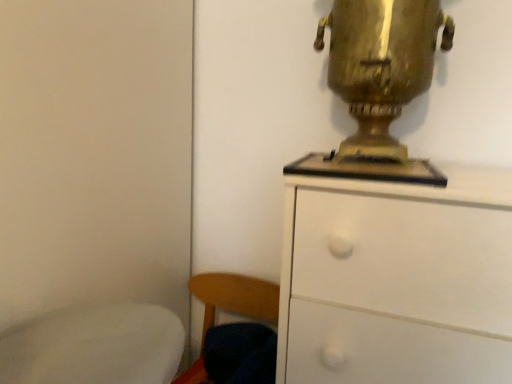
What do you see at coordinates (395, 276) in the screenshot? I see `white matte chest of drawers at upper right` at bounding box center [395, 276].

Identify the location of wooden chair at lower left. The image size is (512, 384). (234, 296).

Between wooden chair at lower left and white matte chest of drawers at upper right, which one has more height?

white matte chest of drawers at upper right.

Consider the image. From the image's perspective, is wooden chair at lower left under white matte chest of drawers at upper right?

Yes, from the image's perspective, wooden chair at lower left is beneath white matte chest of drawers at upper right.

Is wooden chair at lower left directly adjacent to white matte chest of drawers at upper right?

wooden chair at lower left and white matte chest of drawers at upper right are clearly separated.

Is wooden chair at lower left facing towards white matte chest of drawers at upper right?

No, wooden chair at lower left is not turned towards white matte chest of drawers at upper right.

Which object is positioned more to the left, gold metallic samovar at upper right or white matte chest of drawers at upper right?

From the viewer's perspective, gold metallic samovar at upper right appears more on the left side.

Find the location of a particular element. The height and width of the screenshot is (384, 512). table lamp above the white matte chest of drawers at upper right (from a real-world perspective) is located at coordinates (381, 64).

Does point (350, 85) come in front of point (416, 345)?

That is False.

Considering the positions of objects white matte chest of drawers at upper right and wooden chair at lower left in the image provided, who is in front, white matte chest of drawers at upper right or wooden chair at lower left?

white matte chest of drawers at upper right is in front.

Is white matte chest of drawers at upper right far from wooden chair at lower left?

No.

From the picture: Does white matte chest of drawers at upper right have a smaller size compared to wooden chair at lower left?

No, white matte chest of drawers at upper right is not smaller than wooden chair at lower left.

Does white matte chest of drawers at upper right touch gold metallic samovar at upper right?

white matte chest of drawers at upper right and gold metallic samovar at upper right are clearly separated.

From a real-world perspective, between white matte chest of drawers at upper right and gold metallic samovar at upper right, who is vertically higher?

gold metallic samovar at upper right.

Can you tell me how much white matte chest of drawers at upper right and gold metallic samovar at upper right differ in facing direction?

They differ by 6.92 degrees in their facing directions.

From the image's perspective, which object appears higher, white matte chest of drawers at upper right or gold metallic samovar at upper right?

gold metallic samovar at upper right, from the image's perspective.

Is gold metallic samovar at upper right touching wooden chair at lower left?

gold metallic samovar at upper right and wooden chair at lower left are not in contact.

Locate an element on the screen. table lamp in front of the wooden chair at lower left is located at coordinates (381, 64).

How many degrees apart are the facing directions of gold metallic samovar at upper right and wooden chair at lower left?

There is a 6.39-degree angle between the facing directions of gold metallic samovar at upper right and wooden chair at lower left.

Is gold metallic samovar at upper right completely or partially outside of wooden chair at lower left?

Absolutely, gold metallic samovar at upper right is external to wooden chair at lower left.

Which object is positioned more to the left, wooden chair at lower left or gold metallic samovar at upper right?

wooden chair at lower left is more to the left.

Which object is wider, wooden chair at lower left or gold metallic samovar at upper right?

Wider between the two is wooden chair at lower left.

From a real-world perspective, is wooden chair at lower left positioned above or below gold metallic samovar at upper right?

From a real-world perspective, wooden chair at lower left is physically below gold metallic samovar at upper right.

The width and height of the screenshot is (512, 384). Identify the location of chair beneath the white matte chest of drawers at upper right (from a real-world perspective). (234, 296).

At what (x,y) coordinates should I click in order to perform the action: click on table lamp that is above the white matte chest of drawers at upper right (from a real-world perspective). Please return your answer as a coordinate pair (x, y). Looking at the image, I should click on coord(381,64).

Based on their spatial positions, is white matte chest of drawers at upper right or wooden chair at lower left further from gold metallic samovar at upper right?

Based on the image, wooden chair at lower left appears to be further to gold metallic samovar at upper right.

Which object lies nearer to the anchor point gold metallic samovar at upper right, wooden chair at lower left or white matte chest of drawers at upper right?

white matte chest of drawers at upper right.

Which object lies nearer to the anchor point wooden chair at lower left, gold metallic samovar at upper right or white matte chest of drawers at upper right?

Among the two, white matte chest of drawers at upper right is located nearer to wooden chair at lower left.

Estimate the real-world distances between objects in this image. Which object is closer to wooden chair at lower left, white matte chest of drawers at upper right or gold metallic samovar at upper right?

The object closer to wooden chair at lower left is white matte chest of drawers at upper right.

Looking at the image, which one is located closer to white matte chest of drawers at upper right, wooden chair at lower left or gold metallic samovar at upper right?

gold metallic samovar at upper right lies closer to white matte chest of drawers at upper right than the other object.

From the picture: From the image, which object appears to be farther from white matte chest of drawers at upper right, gold metallic samovar at upper right or wooden chair at lower left?

Among the two, wooden chair at lower left is located further to white matte chest of drawers at upper right.

Where is `the chest of drawers between gold metallic samovar at upper right and wooden chair at lower left vertically`? the chest of drawers between gold metallic samovar at upper right and wooden chair at lower left vertically is located at coordinates (395, 276).